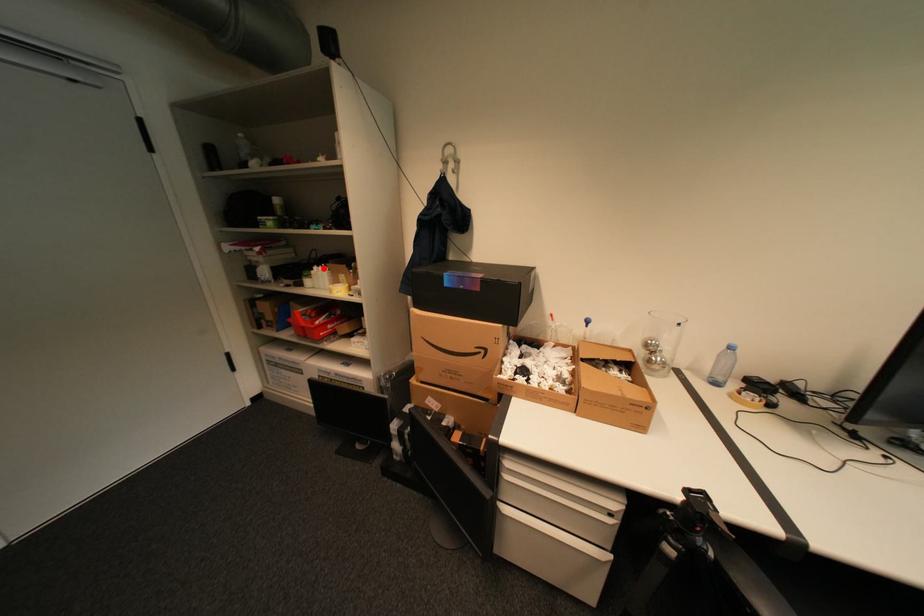
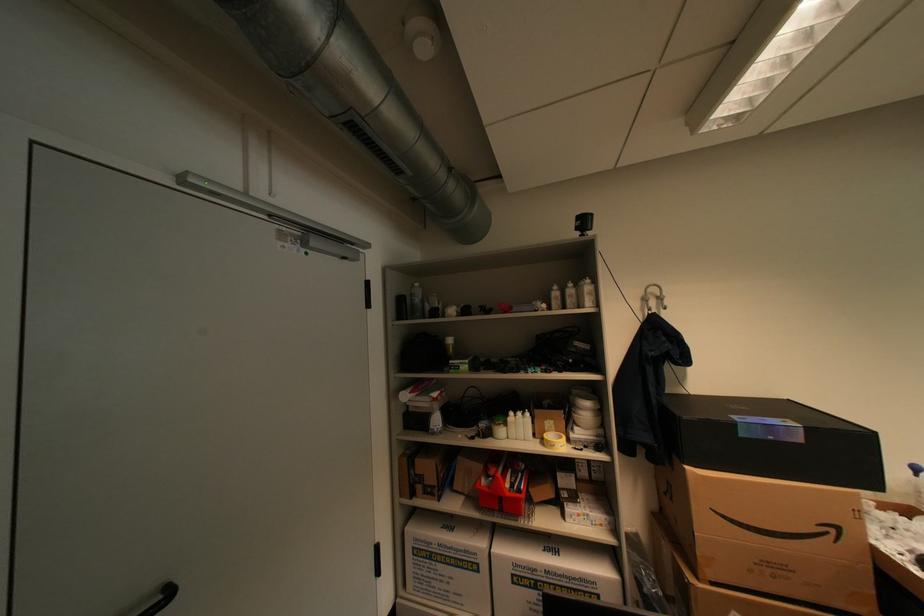
Question: A red point is marked in image1. In image2, is the corresponding 3D point closer to the camera or farther? Reply with the corresponding letter.

Choices:
 (A) The corresponding 3D point is closer.
 (B) The corresponding 3D point is farther.

Answer: (B)